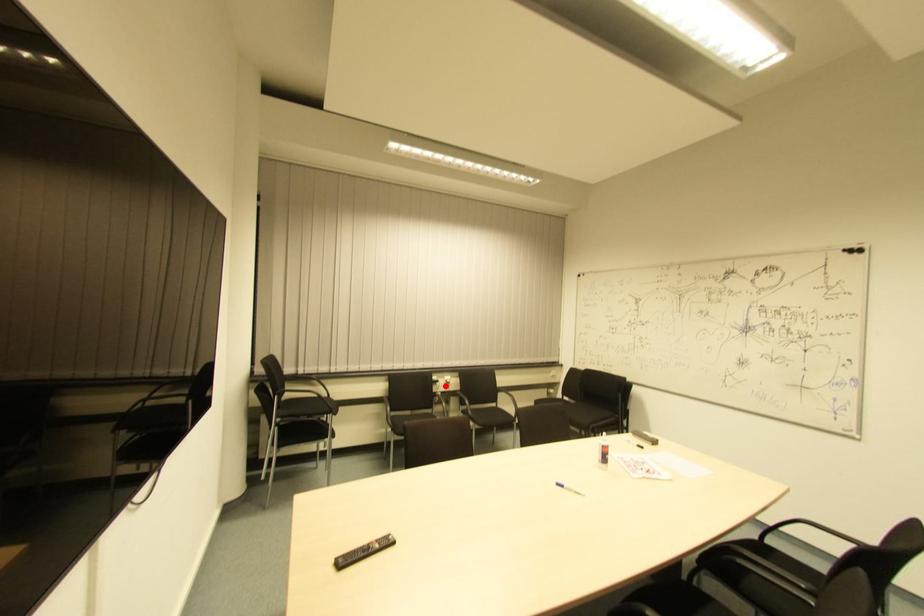
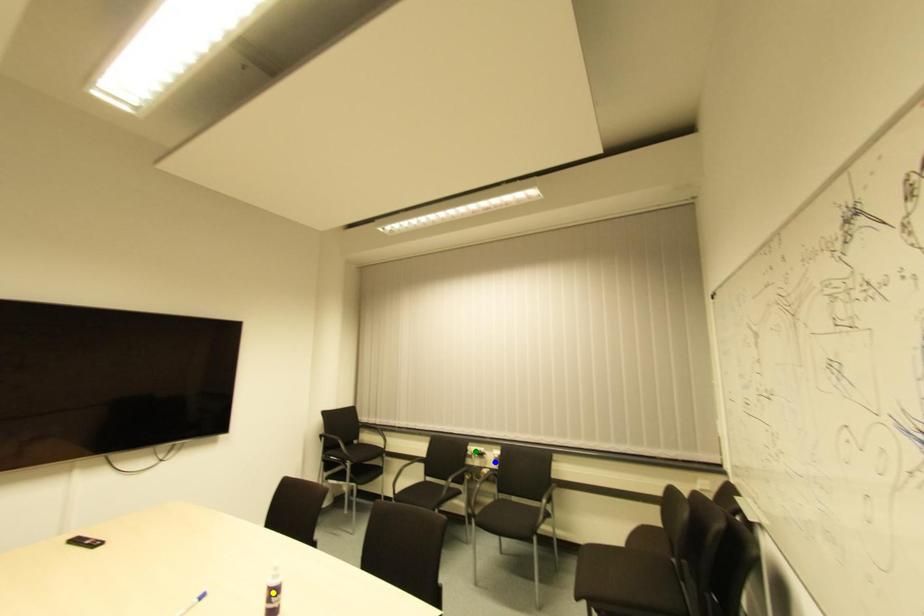
Question: I am providing you with two images of the same scene from different viewpoints. A red point is marked on the first image. You are given multiple points on the second image. Which point in image 2 represents the same 3d spot as the red point in image 1?

Choices:
 (A) yellow point
 (B) blue point
 (C) green point

Answer: (B)